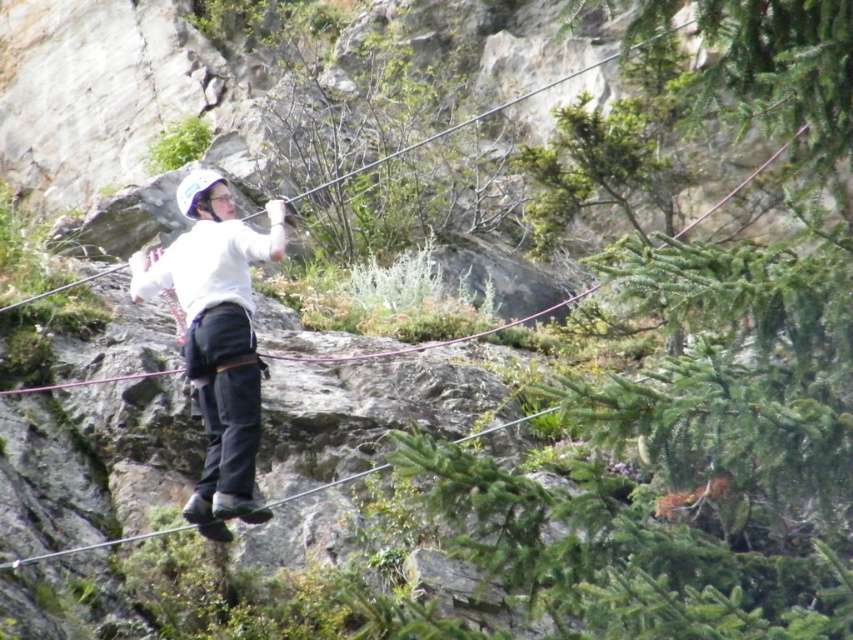
Can you confirm if green leafy tree at center is positioned to the right of white matte helmet at center?

Correct, you'll find green leafy tree at center to the right of white matte helmet at center.

Can you confirm if green leafy tree at center is positioned below white matte helmet at center?

Yes.

Where is `green leafy tree at center`? green leafy tree at center is located at coordinates (683, 452).